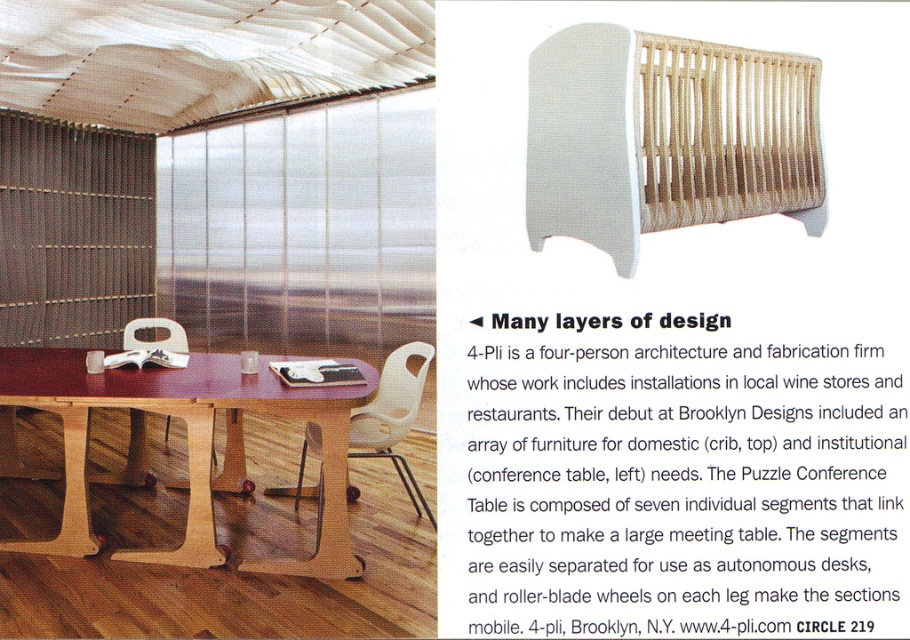
Between natural wood crib at upper right and white plastic chair at lower center, which one is positioned lower?

white plastic chair at lower center

Does natural wood crib at upper right lie in front of white plastic chair at lower center?

Yes, it is in front of white plastic chair at lower center.

What do you see at coordinates (664, 136) in the screenshot? This screenshot has width=910, height=640. I see `natural wood crib at upper right` at bounding box center [664, 136].

I want to click on natural wood crib at upper right, so click(x=664, y=136).

Who is taller, white plastic chair at lower center or white matte chair at center?

With more height is white plastic chair at lower center.

Which is in front, point (397, 353) or point (140, 328)?

Positioned in front is point (397, 353).

Describe the element at coordinates (393, 416) in the screenshot. I see `white plastic chair at lower center` at that location.

You are a GUI agent. You are given a task and a screenshot of the screen. Output one action in this format:
    pyautogui.click(x=<x>, y=<y>)
    Task: Click on the white plastic chair at lower center
    
    Given the screenshot: What is the action you would take?
    pyautogui.click(x=393, y=416)

Is natural wood crib at upper right below mahogany wood conference table at center?

Incorrect, natural wood crib at upper right is not positioned below mahogany wood conference table at center.

At what (x,y) coordinates should I click in order to perform the action: click on natural wood crib at upper right. Please return your answer as a coordinate pair (x, y). The image size is (910, 640). Looking at the image, I should click on (664, 136).

Find the location of `natural wood crib at upper right`. natural wood crib at upper right is located at coordinates (664, 136).